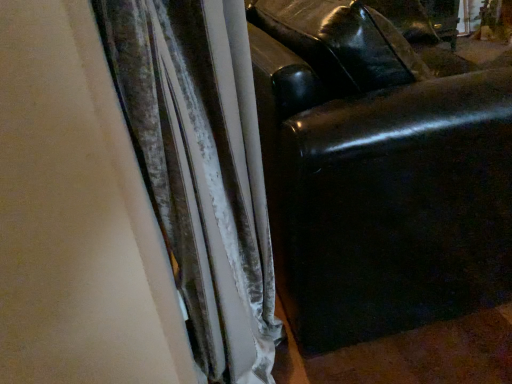
Question: Considering the positions of velvet curtain at center and black leather couch at right in the image, is velvet curtain at center bigger or smaller than black leather couch at right?

Choices:
 (A) big
 (B) small

Answer: (B)

Question: From a real-world perspective, is velvet curtain at center above or below black leather couch at right?

Choices:
 (A) above
 (B) below

Answer: (A)

Question: From the image's perspective, is velvet curtain at center above or below black leather couch at right?

Choices:
 (A) above
 (B) below

Answer: (B)

Question: From the image's perspective, relative to velvet curtain at center, is black leather couch at right above or below?

Choices:
 (A) below
 (B) above

Answer: (B)

Question: Would you say black leather couch at right is to the left or to the right of velvet curtain at center in the picture?

Choices:
 (A) left
 (B) right

Answer: (B)

Question: Considering their positions, is black leather couch at right located in front of or behind velvet curtain at center?

Choices:
 (A) front
 (B) behind

Answer: (B)

Question: Considering the positions of black leather couch at right and velvet curtain at center in the image, is black leather couch at right bigger or smaller than velvet curtain at center?

Choices:
 (A) small
 (B) big

Answer: (B)